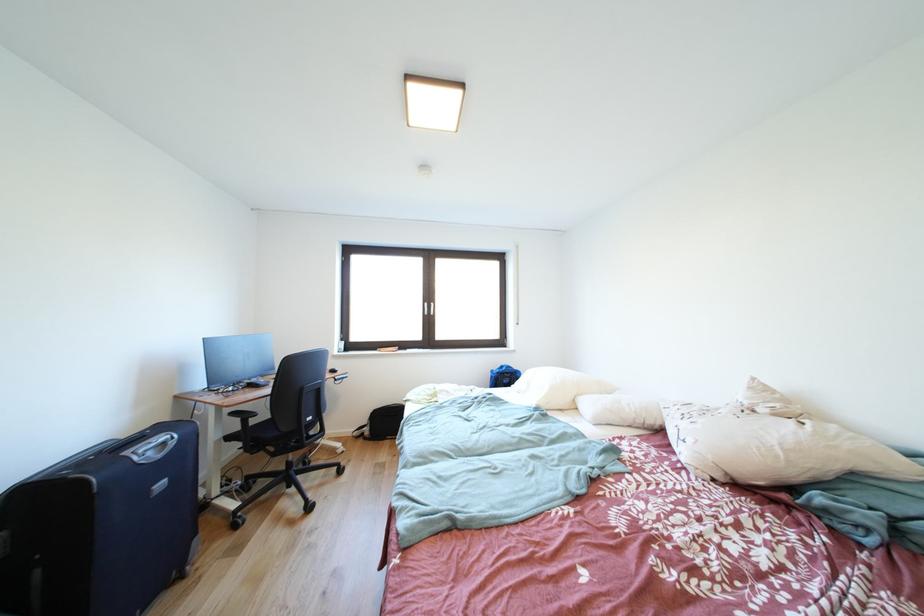
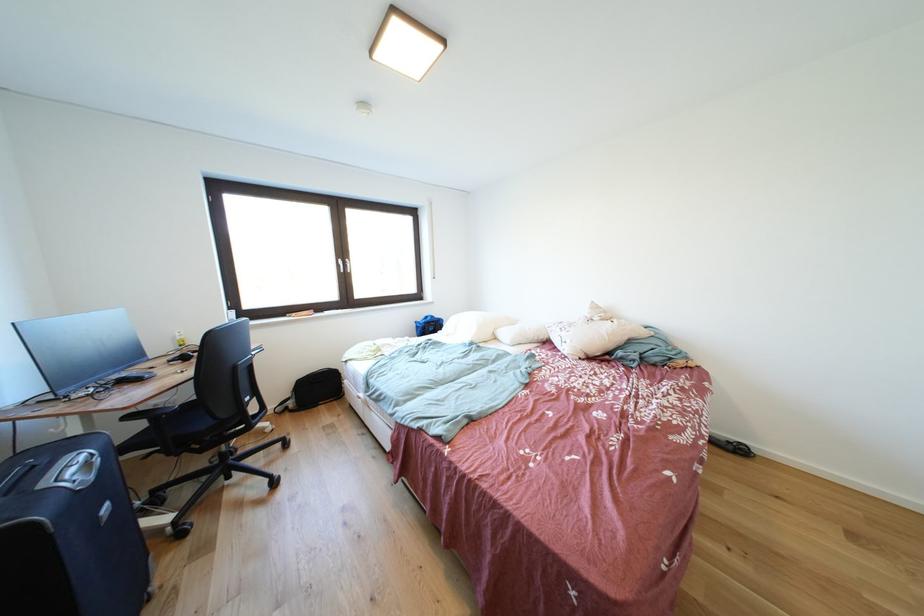
Find the pixel in the second image that matches (x=374, y=435) in the first image.

(299, 408)